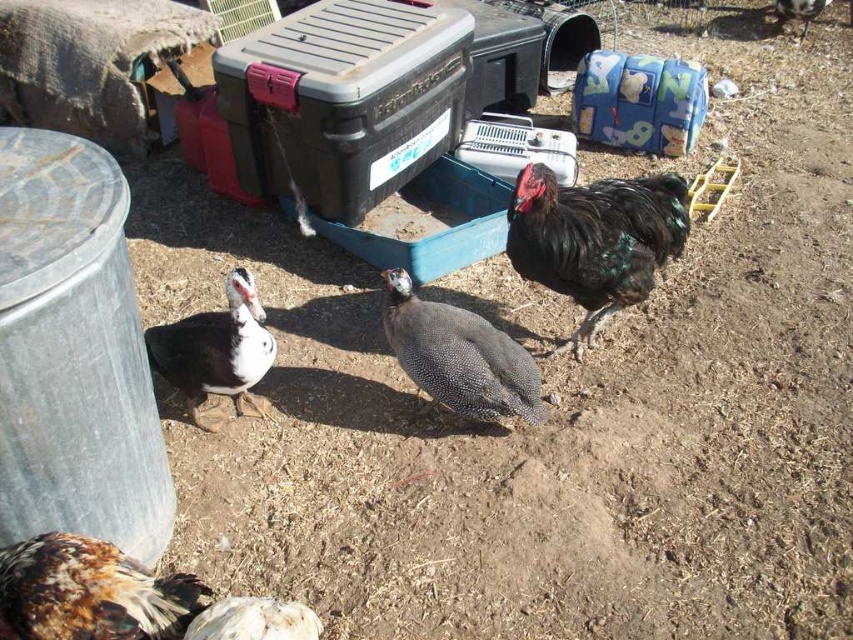
Does point (132, 560) come farther from viewer compared to point (194, 401)?

No, it is not.

Does speckled feathered chicken at lower left have a greater height compared to dark brown feathers at center?

No, speckled feathered chicken at lower left is not taller than dark brown feathers at center.

Between point (9, 624) and point (222, 352), which one is positioned behind?

Point (222, 352)

I want to click on speckled feathered chicken at lower left, so click(x=90, y=593).

Where is `speckled feathered chicken at lower left`? The image size is (853, 640). speckled feathered chicken at lower left is located at coordinates (90, 593).

Is speckled feathered chicken at lower left positioned before speckled feathered guinea fowl at center?

That is True.

Does point (167, 628) come closer to viewer compared to point (485, 332)?

Yes, point (167, 628) is in front of point (485, 332).

At what (x,y) coordinates should I click in order to perform the action: click on speckled feathered chicken at lower left. Please return your answer as a coordinate pair (x, y). The width and height of the screenshot is (853, 640). Looking at the image, I should click on (90, 593).

Who is lower down, shiny black rooster at right or speckled feathered chicken at lower left?

Positioned lower is speckled feathered chicken at lower left.

Is shiny black rooster at right bigger than speckled feathered chicken at lower left?

Yes, shiny black rooster at right is bigger than speckled feathered chicken at lower left.

What do you see at coordinates (595, 240) in the screenshot? I see `shiny black rooster at right` at bounding box center [595, 240].

The height and width of the screenshot is (640, 853). What are the coordinates of `shiny black rooster at right` in the screenshot? It's located at (595, 240).